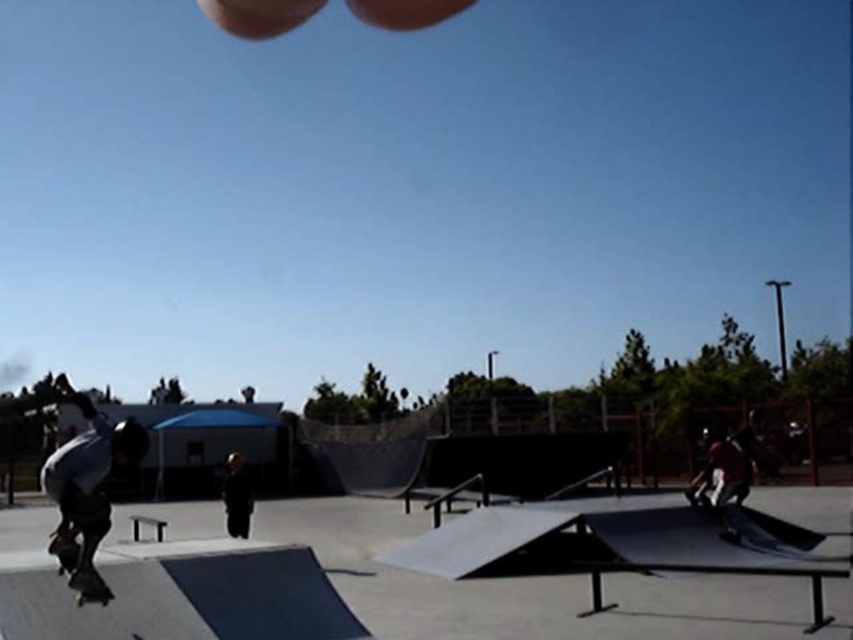
You are a photographer positioned at the edge of the skate park. You want to capture a photo that includes both the smooth concrete ramp at center and the black matte skateboard at lower left. Based on their positions, which object should you pan your camera towards first to ensure both are in frame?

The smooth concrete ramp at center is to the left of the black matte skateboard at lower left. To include both in the frame, you should pan your camera towards the smooth concrete ramp at center first as it is positioned further left and the skateboard is to its right.